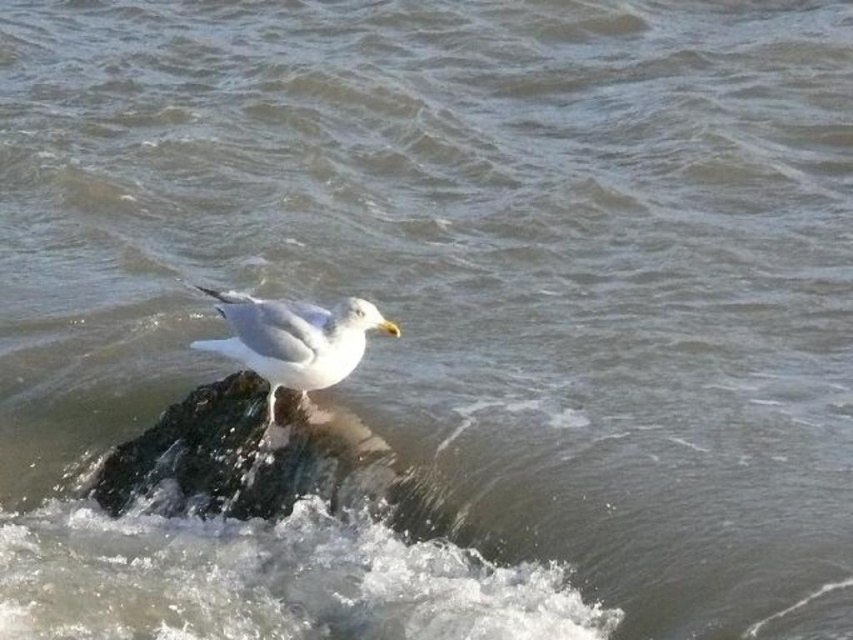
Question: Which of the following is the closest to the observer?

Choices:
 (A) pyautogui.click(x=236, y=426)
 (B) pyautogui.click(x=341, y=378)

Answer: (B)

Question: Does rough textured rock at center appear under white feathered bird at center?

Choices:
 (A) yes
 (B) no

Answer: (A)

Question: Is rough textured rock at center above white feathered bird at center?

Choices:
 (A) yes
 (B) no

Answer: (B)

Question: Which object is closer to the camera taking this photo?

Choices:
 (A) white feathered bird at center
 (B) rough textured rock at center

Answer: (A)

Question: Which point is closer to the camera taking this photo?

Choices:
 (A) (260, 497)
 (B) (241, 308)

Answer: (A)

Question: Where is rough textured rock at center located in relation to white feathered bird at center in the image?

Choices:
 (A) left
 (B) right

Answer: (A)